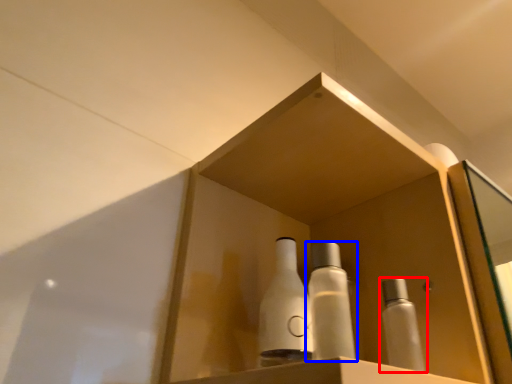
Question: Among these objects, which one is nearest to the camera, bottle (highlighted by a red box) or bottle (highlighted by a blue box)?

Choices:
 (A) bottle
 (B) bottle

Answer: (B)